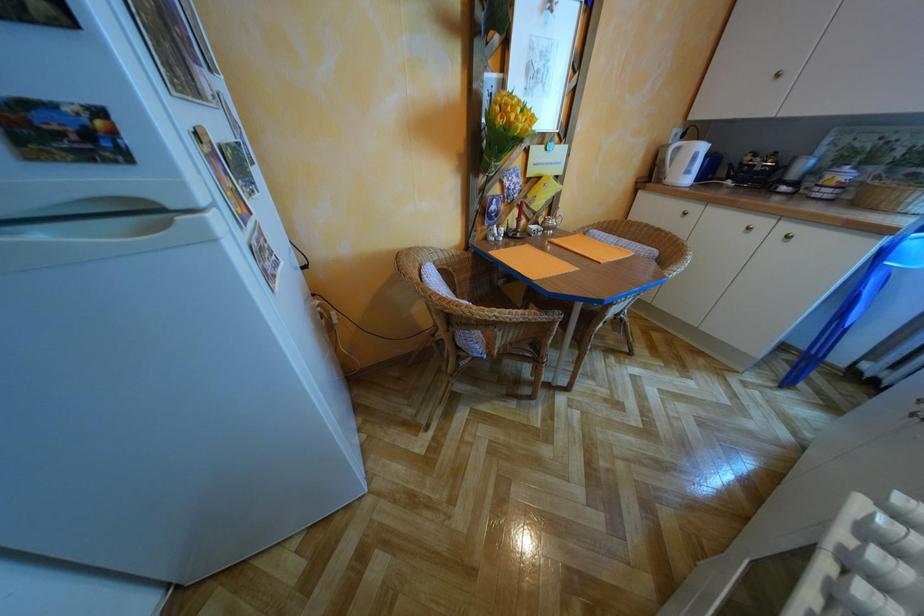
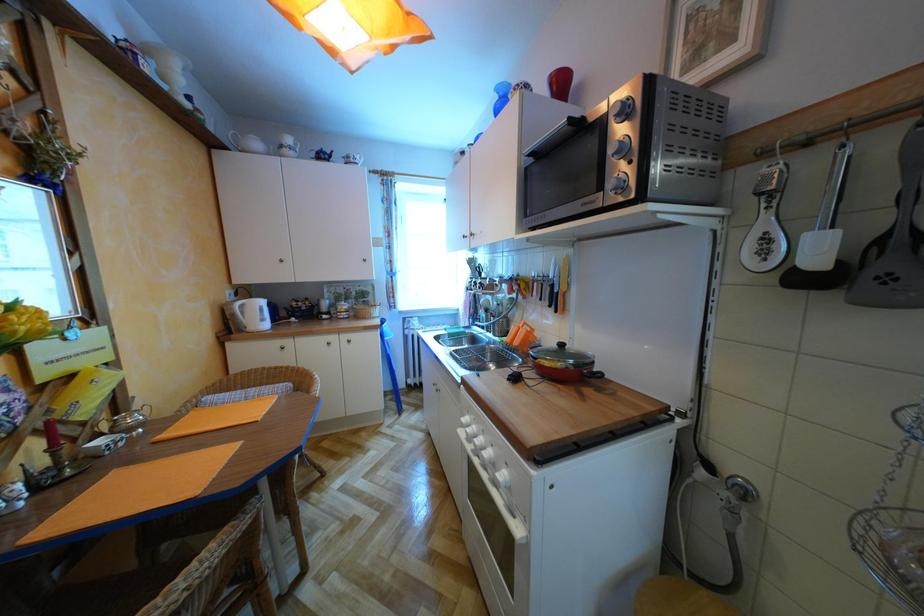
Question: Based on the continuous images, in which direction is the camera rotating? Reply with the corresponding letter.

Choices:
 (A) Left
 (B) Right
 (C) Up
 (D) Down

Answer: (B)